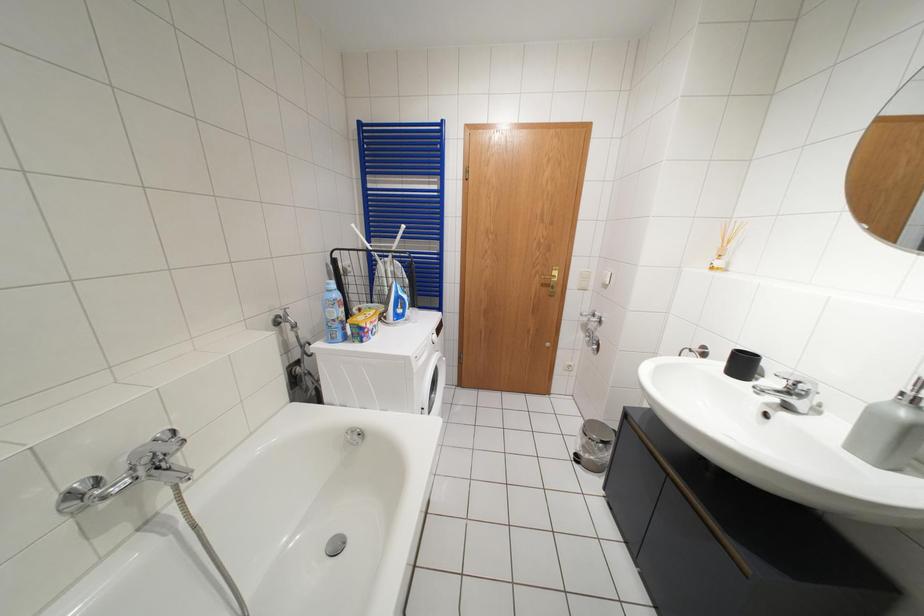
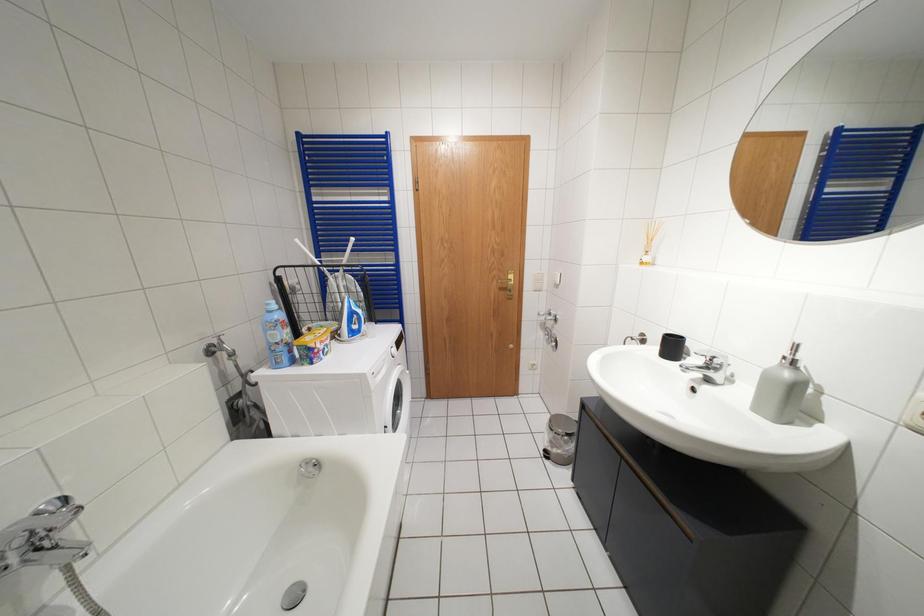
Question: Which direction would the cameraman need to move to produce the second image? Reply with the corresponding letter.

Choices:
 (A) Left
 (B) Right
 (C) Forward
 (D) Backward

Answer: (B)